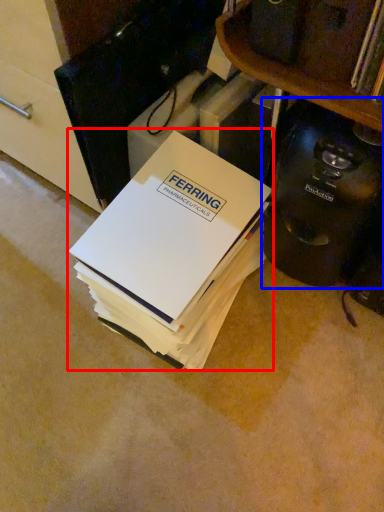
Question: Which of the following is the closest to the observer, paperback book (highlighted by a red box) or home appliance (highlighted by a blue box)?

Choices:
 (A) paperback book
 (B) home appliance

Answer: (B)